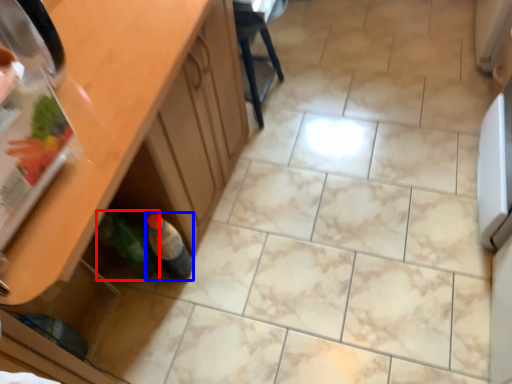
Question: Which of the following is the closest to the observer, bottle (highlighted by a red box) or bottle (highlighted by a blue box)?

Choices:
 (A) bottle
 (B) bottle

Answer: (A)